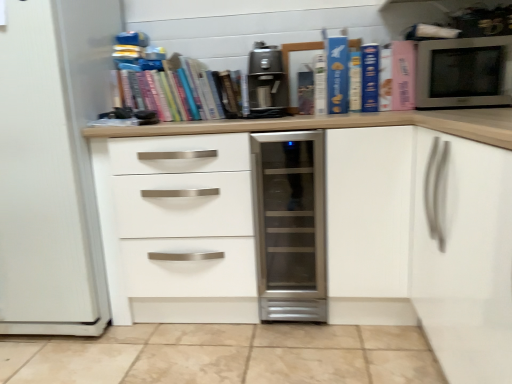
Question: Considering the relative sizes of blue matte book at upper center, placed as the 4th paperback book when sorted from right to left, and matte paper at center, which appears as the 1th paperback book when viewed from the left, in the image provided, is blue matte book at upper center, placed as the 4th paperback book when sorted from right to left, taller than matte paper at center, which appears as the 1th paperback book when viewed from the left,?

Choices:
 (A) no
 (B) yes

Answer: (B)

Question: Is blue matte book at upper center, placed as the 4th paperback book when sorted from right to left, thinner than matte paper at center, arranged as the seventh paperback book when viewed from the right?

Choices:
 (A) yes
 (B) no

Answer: (B)

Question: Is blue matte book at upper center, marked as the fourth paperback book in a left-to-right arrangement, outside matte paper at center, which appears as the 1th paperback book when viewed from the left?

Choices:
 (A) yes
 (B) no

Answer: (A)

Question: Is blue matte book at upper center, marked as the fourth paperback book in a left-to-right arrangement, positioned in front of matte paper at center, arranged as the seventh paperback book when viewed from the right?

Choices:
 (A) yes
 (B) no

Answer: (A)

Question: Is blue matte book at upper center, marked as the fourth paperback book in a left-to-right arrangement, facing towards matte paper at center, which appears as the 1th paperback book when viewed from the left?

Choices:
 (A) yes
 (B) no

Answer: (B)

Question: Is satin silver coffee machine at upper center in front of or behind hardcover book at center, arranged as the 6th paperback book when viewed from the right, in the image?

Choices:
 (A) behind
 (B) front

Answer: (B)

Question: From a real-world perspective, is satin silver coffee machine at upper center above or below hardcover book at center, which appears as the second paperback book when viewed from the left?

Choices:
 (A) above
 (B) below

Answer: (A)

Question: Is point (276, 64) positioned closer to the camera than point (322, 69)?

Choices:
 (A) closer
 (B) farther

Answer: (B)

Question: Is satin silver coffee machine at upper center spatially inside hardcover book at center, which appears as the second paperback book when viewed from the left, or outside of it?

Choices:
 (A) inside
 (B) outside

Answer: (B)

Question: From a real-world perspective, is hardcover books at upper center above or below hardcover book at center, which appears as the second paperback book when viewed from the left?

Choices:
 (A) below
 (B) above

Answer: (B)

Question: Is hardcover books at upper center wider or thinner than hardcover book at center, which appears as the second paperback book when viewed from the left?

Choices:
 (A) wide
 (B) thin

Answer: (A)

Question: Considering the positions of point (158, 84) and point (325, 100), is point (158, 84) closer or farther from the camera than point (325, 100)?

Choices:
 (A) farther
 (B) closer

Answer: (A)

Question: Considering the relative positions of hardcover books at upper center and hardcover book at center, which appears as the second paperback book when viewed from the left, in the image provided, is hardcover books at upper center to the left or to the right of hardcover book at center, which appears as the second paperback book when viewed from the left,?

Choices:
 (A) right
 (B) left

Answer: (B)

Question: Is blue matte book at upper center, which ranks as the 3th paperback book in right-to-left order, situated inside hardcover book at center, arranged as the 6th paperback book when viewed from the right, or outside?

Choices:
 (A) outside
 (B) inside

Answer: (A)

Question: From the image's perspective, is blue matte book at upper center, which ranks as the 3th paperback book in right-to-left order, above or below hardcover book at center, arranged as the 6th paperback book when viewed from the right?

Choices:
 (A) above
 (B) below

Answer: (A)